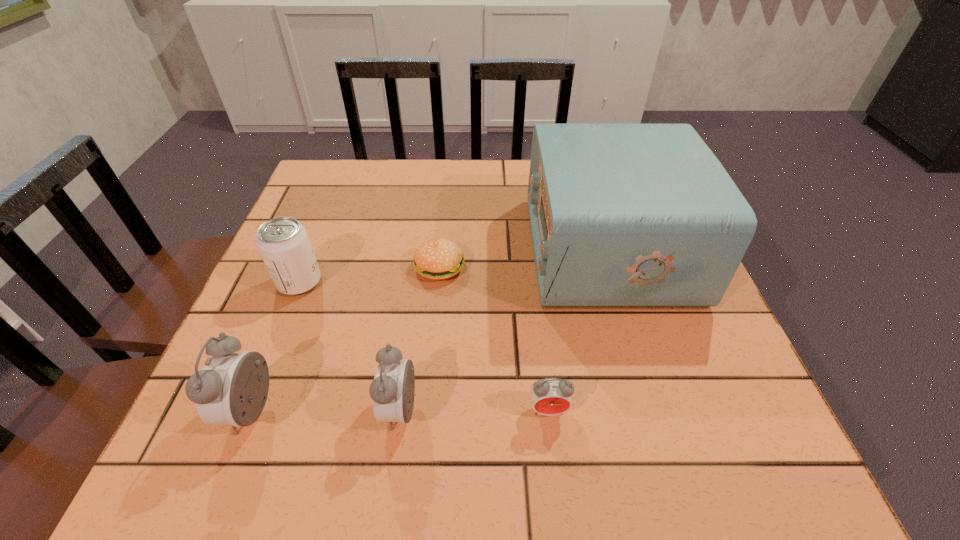
Find the location of `vacant position located on the back of the patty`. vacant position located on the back of the patty is located at coordinates (447, 183).

This screenshot has width=960, height=540. Identify the location of vacant space located on the back of the soda can. (312, 252).

Locate an element on the screen. Image resolution: width=960 pixels, height=540 pixels. vacant space located on the front panel of the radio receiver is located at coordinates (441, 249).

The height and width of the screenshot is (540, 960). I want to click on vacant region located on the front panel of the radio receiver, so click(441, 249).

The height and width of the screenshot is (540, 960). I want to click on vacant space situated 0.100m on the front panel of the radio receiver, so click(488, 249).

Where is `object at the far edge`? object at the far edge is located at coordinates (622, 215).

Identify the location of alarm clock that is at the left edge. (232, 388).

Where is `soda can that is at the left edge`? This screenshot has width=960, height=540. soda can that is at the left edge is located at coordinates (283, 243).

Identify the location of object that is at the right edge. (622, 215).

Locate an element on the screen. object present at the near left corner is located at coordinates (232, 388).